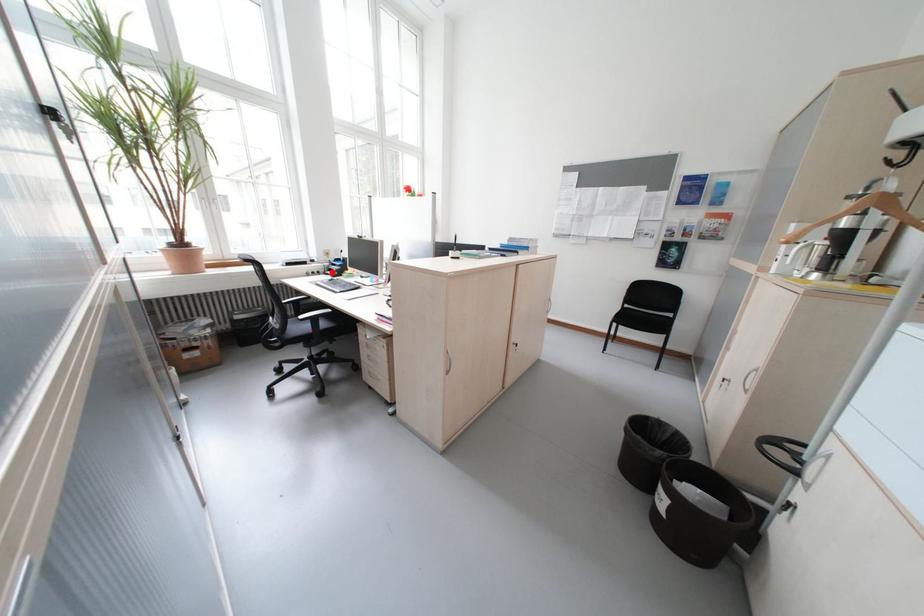
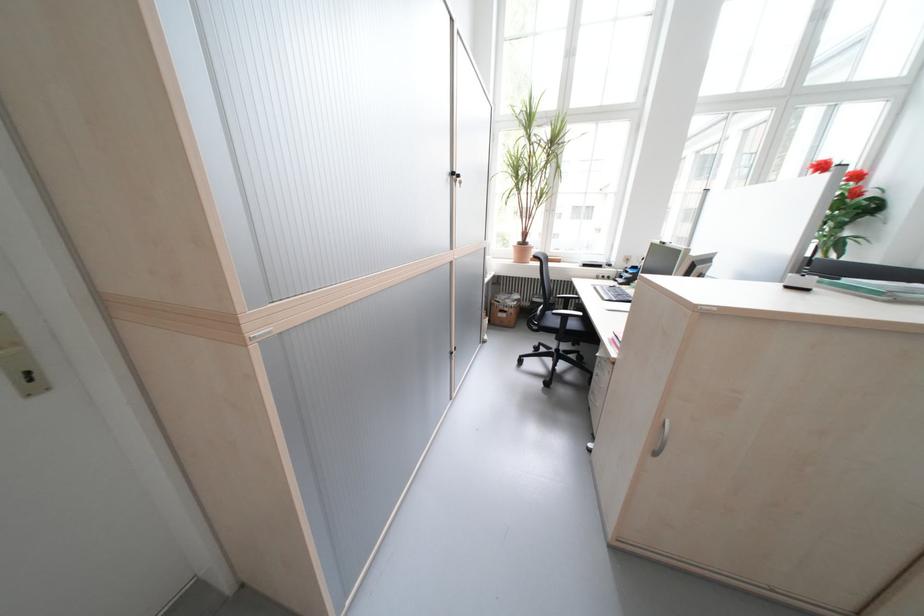
In the second image, find the point that corresponds to the highlighted location in the first image.

(623, 278)